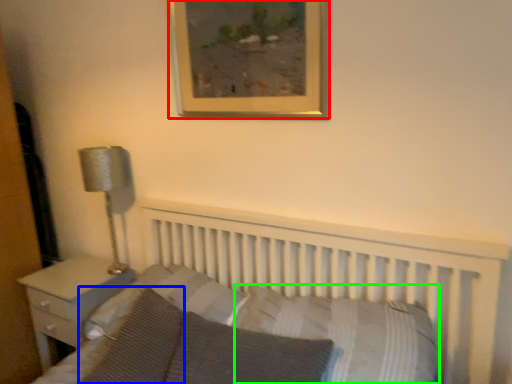
Question: Which object is positioned closest to picture frame (highlighted by a red box)? Select from pillow (highlighted by a blue box) and pillow (highlighted by a green box).

Choices:
 (A) pillow
 (B) pillow

Answer: (B)